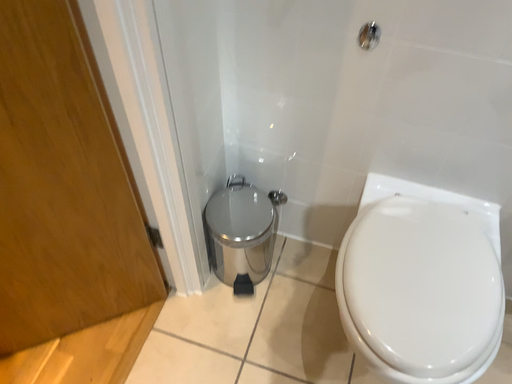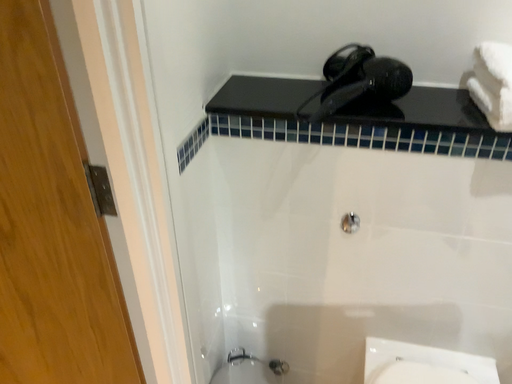
Question: Which way did the camera rotate in the video?

Choices:
 (A) rotated downward
 (B) rotated upward

Answer: (B)